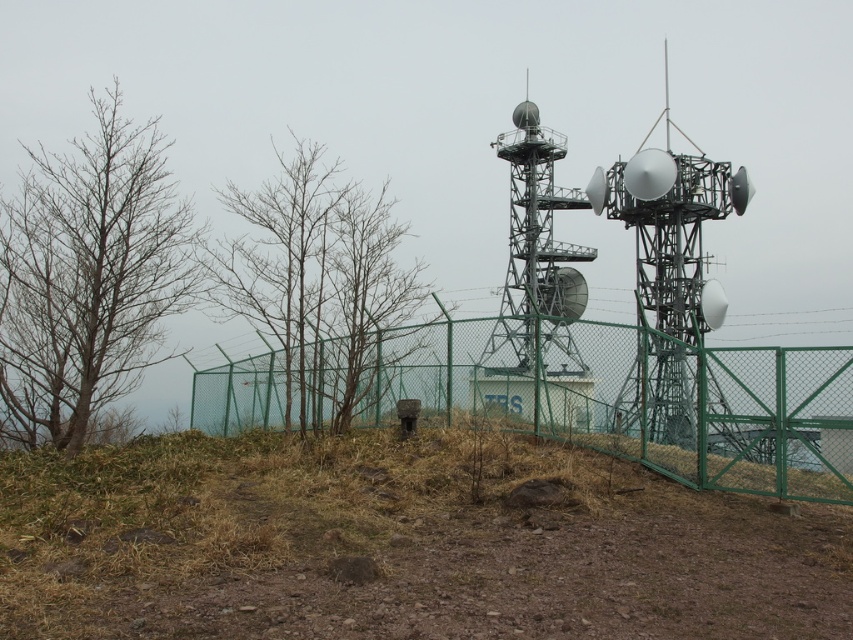
Is green mesh fence at center to the left of metallic gray tower at center from the viewer's perspective?

Indeed, green mesh fence at center is positioned on the left side of metallic gray tower at center.

At what (x,y) coordinates should I click in order to perform the action: click on green mesh fence at center. Please return your answer as a coordinate pair (x, y). Looking at the image, I should click on (642, 401).

Find the location of a particular element. Image resolution: width=853 pixels, height=640 pixels. green mesh fence at center is located at coordinates (642, 401).

Does bare branches at left appear on the right side of bare wood at center?

No, bare branches at left is not to the right of bare wood at center.

I want to click on bare branches at left, so click(x=316, y=280).

Does green mesh fence at center appear on the left side of bare branches at left?

Incorrect, green mesh fence at center is not on the left side of bare branches at left.

Based on the photo, which is more to the left, green mesh fence at center or bare branches at left?

bare branches at left

Is point (202, 390) more distant than point (404, 225)?

No, it is not.

This screenshot has height=640, width=853. I want to click on green mesh fence at center, so click(x=642, y=401).